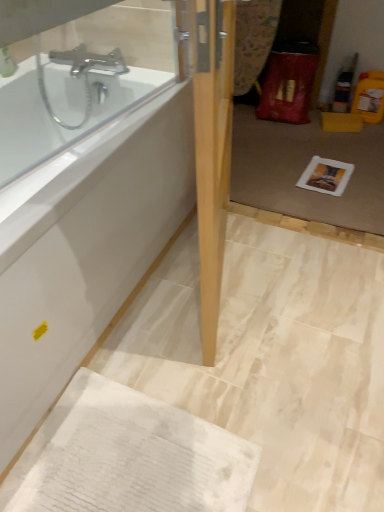
You are a GUI agent. You are given a task and a screenshot of the screen. Output one action in this format:
    pyautogui.click(x=<x>, y=<y>)
    Task: Click on the free spot below light wood door at center (from a real-world perspective)
    The width and height of the screenshot is (384, 512).
    Given the screenshot: What is the action you would take?
    pyautogui.click(x=219, y=297)